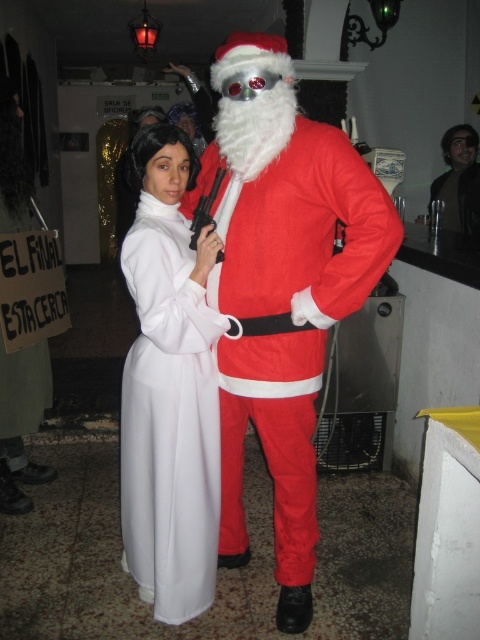
Can you confirm if smooth black hair at upper right is positioned to the left of metallic silver gun at center?

Incorrect, smooth black hair at upper right is not on the left side of metallic silver gun at center.

Based on the photo, does smooth black hair at upper right appear over metallic silver gun at center?

Yes.

The image size is (480, 640). Identify the location of smooth black hair at upper right. (458, 180).

Where is `white satin dress at center`? The height and width of the screenshot is (640, 480). white satin dress at center is located at coordinates (168, 419).

Can you confirm if white satin dress at center is taller than smooth black hair at upper right?

Indeed, white satin dress at center has a greater height compared to smooth black hair at upper right.

Who is more distant from viewer, (177, 224) or (435, 189)?

The point (435, 189) is more distant.

Identify the location of white satin dress at center. (168, 419).

What do you see at coordinates (282, 289) in the screenshot?
I see `velvet red santa suit at center` at bounding box center [282, 289].

Does velvet red santa suit at center lie in front of metallic silver gun at center?

That is True.

In the scene shown: Who is more forward, (268, 109) or (196, 212)?

Positioned in front is point (268, 109).

At what (x,y) coordinates should I click in order to perform the action: click on velvet red santa suit at center. Please return your answer as a coordinate pair (x, y). This screenshot has height=640, width=480. Looking at the image, I should click on (282, 289).